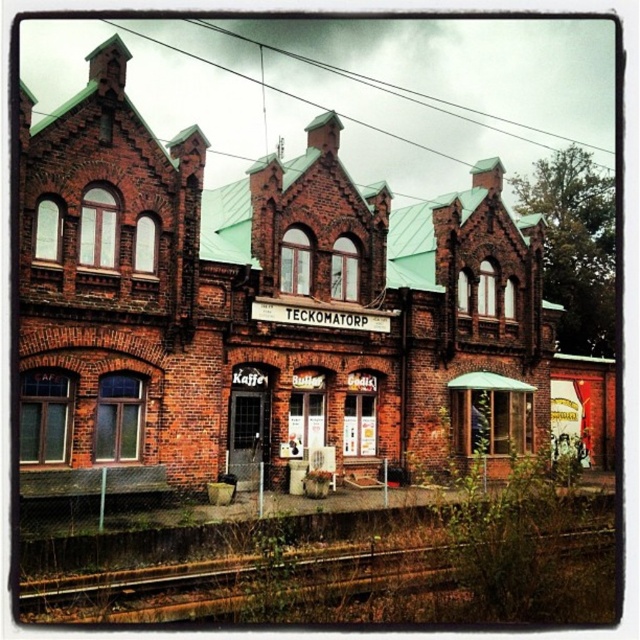
Does brick building at center appear on the right side of rusty metal train track at lower left?

Correct, you'll find brick building at center to the right of rusty metal train track at lower left.

Which is above, brick building at center or rusty metal train track at lower left?

brick building at center is higher up.

Which is in front, point (452, 451) or point (579, 532)?

Point (579, 532) is more forward.

You are a GUI agent. You are given a task and a screenshot of the screen. Output one action in this format:
    pyautogui.click(x=<x>, y=<y>)
    Task: Click on the brick building at center
    This screenshot has height=640, width=640.
    Given the screenshot: What is the action you would take?
    point(308,260)